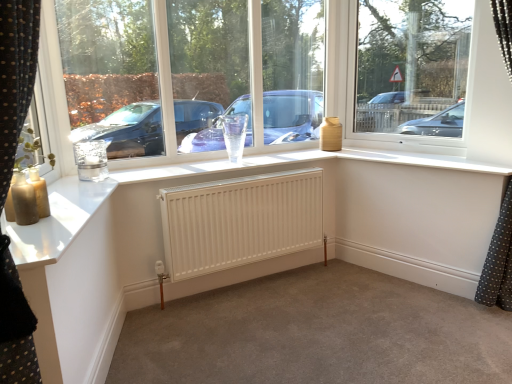
Question: Is transparent glass window at upper right smaller than white matte radiator at center?

Choices:
 (A) yes
 (B) no

Answer: (A)

Question: Is transparent glass window at upper right further to camera compared to white matte radiator at center?

Choices:
 (A) no
 (B) yes

Answer: (B)

Question: Does transparent glass window at upper right have a lesser height compared to white matte radiator at center?

Choices:
 (A) yes
 (B) no

Answer: (B)

Question: Is transparent glass window at upper right beside white matte radiator at center?

Choices:
 (A) yes
 (B) no

Answer: (B)

Question: From the image's perspective, is transparent glass window at upper right under white matte radiator at center?

Choices:
 (A) yes
 (B) no

Answer: (B)

Question: From the image's perspective, is transparent glass vase at upper center positioned above or below white matte radiator at center?

Choices:
 (A) above
 (B) below

Answer: (A)

Question: Is point (250, 18) positioned closer to the camera than point (241, 331)?

Choices:
 (A) farther
 (B) closer

Answer: (A)

Question: In the image, is transparent glass vase at upper center on the left side or the right side of white matte radiator at center?

Choices:
 (A) left
 (B) right

Answer: (A)

Question: Is transparent glass vase at upper center taller or shorter than white matte radiator at center?

Choices:
 (A) short
 (B) tall

Answer: (B)

Question: From a real-world perspective, is transparent glass window at upper right physically located above or below white matte radiator at center?

Choices:
 (A) below
 (B) above

Answer: (B)

Question: Based on their sizes in the image, would you say transparent glass window at upper right is bigger or smaller than white matte radiator at center?

Choices:
 (A) small
 (B) big

Answer: (A)

Question: Is transparent glass window at upper right spatially inside white matte radiator at center, or outside of it?

Choices:
 (A) inside
 (B) outside

Answer: (B)

Question: In terms of height, does transparent glass window at upper right look taller or shorter compared to white matte radiator at center?

Choices:
 (A) short
 (B) tall

Answer: (B)

Question: Is transparent glass window at upper right to the left or to the right of transparent glass vase at upper center in the image?

Choices:
 (A) left
 (B) right

Answer: (B)

Question: From a real-world perspective, is transparent glass window at upper right positioned above or below transparent glass vase at upper center?

Choices:
 (A) below
 (B) above

Answer: (A)